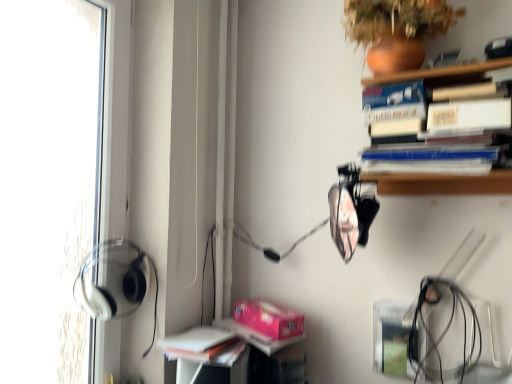
Question: Does pink matte paperback book at lower center have a greater height compared to white matte book at lower left?

Choices:
 (A) yes
 (B) no

Answer: (A)

Question: Is pink matte paperback book at lower center thinner than white matte book at lower left?

Choices:
 (A) yes
 (B) no

Answer: (B)

Question: Are pink matte paperback book at lower center and white matte book at lower left located far from each other?

Choices:
 (A) no
 (B) yes

Answer: (A)

Question: From a real-world perspective, is pink matte paperback book at lower center positioned over white matte book at lower left based on gravity?

Choices:
 (A) yes
 (B) no

Answer: (A)

Question: From the image's perspective, is pink matte paperback book at lower center beneath white matte book at lower left?

Choices:
 (A) no
 (B) yes

Answer: (A)

Question: From their relative heights in the image, would you say pink matte paperback book at lower center is taller or shorter than terracotta clay vase at upper right?

Choices:
 (A) short
 (B) tall

Answer: (A)

Question: From the image's perspective, is pink matte paperback book at lower center positioned above or below terracotta clay vase at upper right?

Choices:
 (A) below
 (B) above

Answer: (A)

Question: From a real-world perspective, is pink matte paperback book at lower center positioned above or below terracotta clay vase at upper right?

Choices:
 (A) below
 (B) above

Answer: (A)

Question: In terms of size, does pink matte paperback book at lower center appear bigger or smaller than terracotta clay vase at upper right?

Choices:
 (A) big
 (B) small

Answer: (B)

Question: Does point (233, 337) appear closer or farther from the camera than point (443, 19)?

Choices:
 (A) closer
 (B) farther

Answer: (B)

Question: Looking at their shapes, would you say white matte book at lower left is wider or thinner than terracotta clay vase at upper right?

Choices:
 (A) thin
 (B) wide

Answer: (A)

Question: Is white matte book at lower left taller or shorter than terracotta clay vase at upper right?

Choices:
 (A) short
 (B) tall

Answer: (A)

Question: Based on their sizes in the image, would you say white matte book at lower left is bigger or smaller than terracotta clay vase at upper right?

Choices:
 (A) small
 (B) big

Answer: (A)

Question: From a real-world perspective, is terracotta clay vase at upper right positioned above or below white matte book at lower left?

Choices:
 (A) above
 (B) below

Answer: (A)

Question: Looking at their shapes, would you say terracotta clay vase at upper right is wider or thinner than white matte book at lower left?

Choices:
 (A) wide
 (B) thin

Answer: (A)